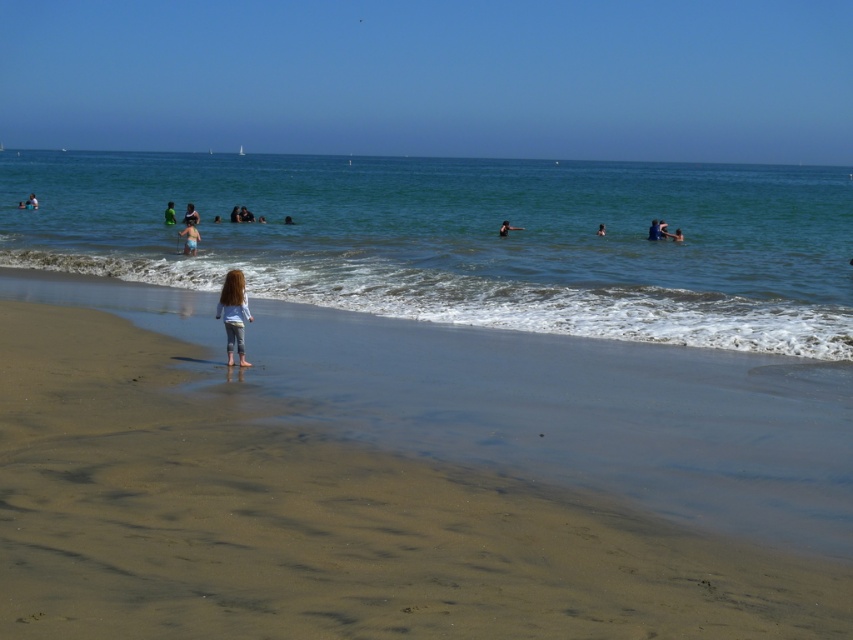
You are standing on the beach and want to throw a beach ball to the blue fabric swimmer at upper right and the green fabric person at center. Which one is farther away from you?

The blue fabric swimmer at upper right is 17.47 meters away from the green fabric person at center. Since you are on the beach, the distance to each would depend on your position, but based on their separation, the blue fabric swimmer at upper right is farther from the green fabric person at center. However, without knowing your exact location, it is impossible to determine which is farther from you personally.

You are a photographer at the beach scene. You want to capture a photo that includes both the blue fabric swimmer at upper right and the dark blue fabric at center. Which object should be positioned to the right side of the photo frame?

The blue fabric swimmer at upper right should be positioned to the right side of the photo frame because it is located to the right of the dark blue fabric at center.